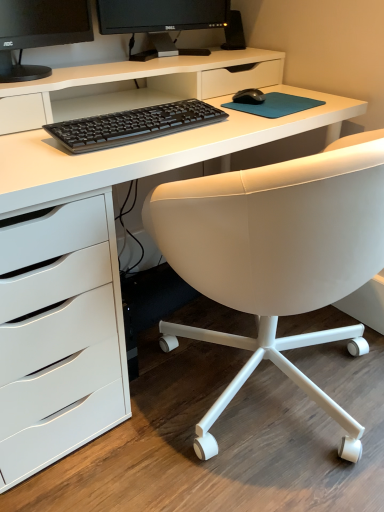
Question: From the image's perspective, is white leather chair at center located above or below black matte mouse at center?

Choices:
 (A) above
 (B) below

Answer: (B)

Question: Is point (365, 221) closer or farther from the camera than point (258, 90)?

Choices:
 (A) closer
 (B) farther

Answer: (A)

Question: Considering the real-world distances, which object is farthest from the black glossy monitor at upper center?

Choices:
 (A) black plastic speaker at upper center
 (B) black matte mouse at center
 (C) white leather chair at center
 (D) black matte keyboard at center

Answer: (C)

Question: Which of these objects is positioned closest to the black plastic speaker at upper center?

Choices:
 (A) black matte keyboard at center
 (B) black matte mouse at center
 (C) black glossy monitor at upper center
 (D) white leather chair at center

Answer: (C)